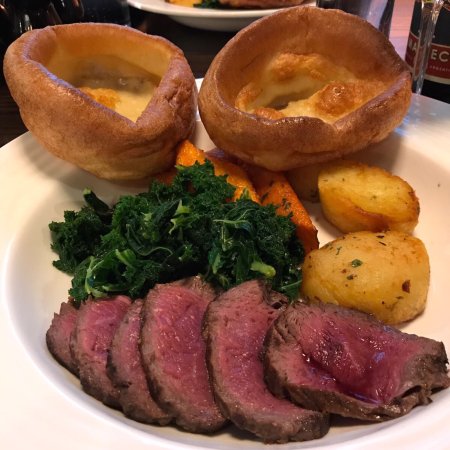
This screenshot has width=450, height=450. What are the coordinates of `plate` in the screenshot? It's located at (429, 160).